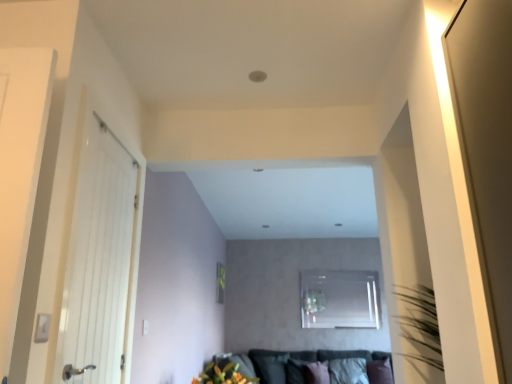
Question: From the image's perspective, is white wooden door at left above or below black fabric pillow at lower center, which is the first pillow in left-to-right order?

Choices:
 (A) below
 (B) above

Answer: (B)

Question: Considering their positions, is white wooden door at left located in front of or behind black fabric pillow at lower center, arranged as the 3th pillow when viewed from the right?

Choices:
 (A) front
 (B) behind

Answer: (A)

Question: Which of these objects is positioned farthest from the black fabric pillow at lower center, arranged as the 3th pillow when viewed from the right?

Choices:
 (A) white fabric pillow at lower center, which appears as the second pillow when viewed from the left
 (B) transparent glass window at center
 (C) white wooden door at left
 (D) vibrant orange flowers at lower center
 (E) purple velvet pillow at lower right, which is the first pillow in right-to-left order

Answer: (C)

Question: Which object is the closest to the white wooden door at left?

Choices:
 (A) velvet dark grey couch at lower center
 (B) white fabric pillow at lower center, which is counted as the second pillow, starting from the right
 (C) black fabric pillow at lower center, which is the first pillow in left-to-right order
 (D) transparent glass window at center
 (E) purple velvet pillow at lower right, positioned as the 3th pillow in left-to-right order

Answer: (C)